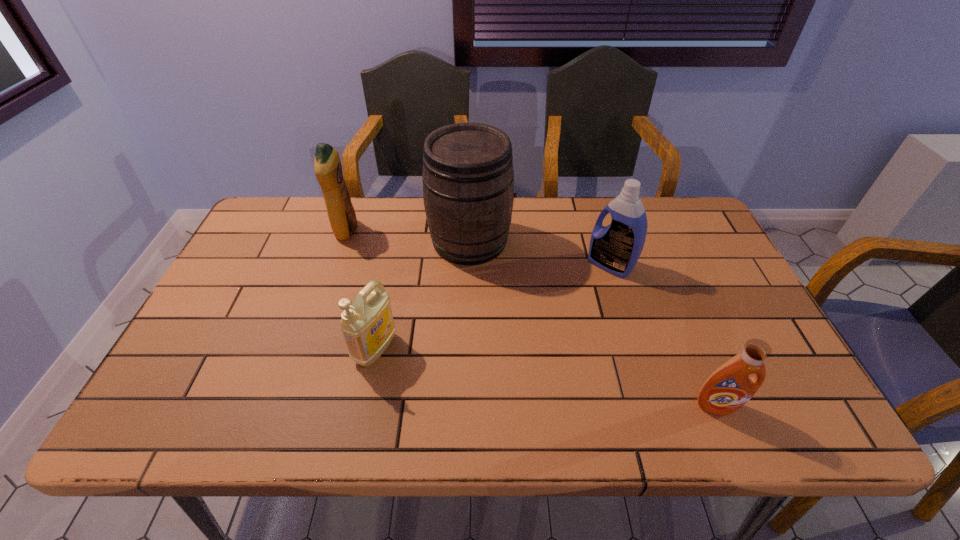
Identify the location of vacant point located on the label of the leftmost object. (441, 231).

Locate an element on the screen. blank area located 0.200m on the left of the second detergent from right to left is located at coordinates (x=517, y=265).

The image size is (960, 540). Identify the location of free space located on the left of the second detergent from left to right. (297, 349).

This screenshot has height=540, width=960. Find the location of `wine bucket that is at the far edge`. wine bucket that is at the far edge is located at coordinates (468, 179).

The image size is (960, 540). Find the location of `detergent that is at the far edge`. detergent that is at the far edge is located at coordinates (327, 165).

You are a GUI agent. You are given a task and a screenshot of the screen. Output one action in this format:
    pyautogui.click(x=<x>, y=<y>)
    Task: Click on the object positioned at the near edge
    Image resolution: width=960 pixels, height=540 pixels.
    Given the screenshot: What is the action you would take?
    pyautogui.click(x=729, y=387)

Locate an element on the screen. object that is positioned at the right edge is located at coordinates (729, 387).

Locate an element on the screen. This screenshot has width=960, height=540. object that is positioned at the near right corner is located at coordinates (729, 387).

At what (x,y) coordinates should I click in order to perform the action: click on vacant space at the far edge of the desktop. Please return your answer as a coordinate pair (x, y). The image size is (960, 540). Looking at the image, I should click on (312, 217).

Where is `free spot at the near edge of the desktop`? free spot at the near edge of the desktop is located at coordinates (610, 429).